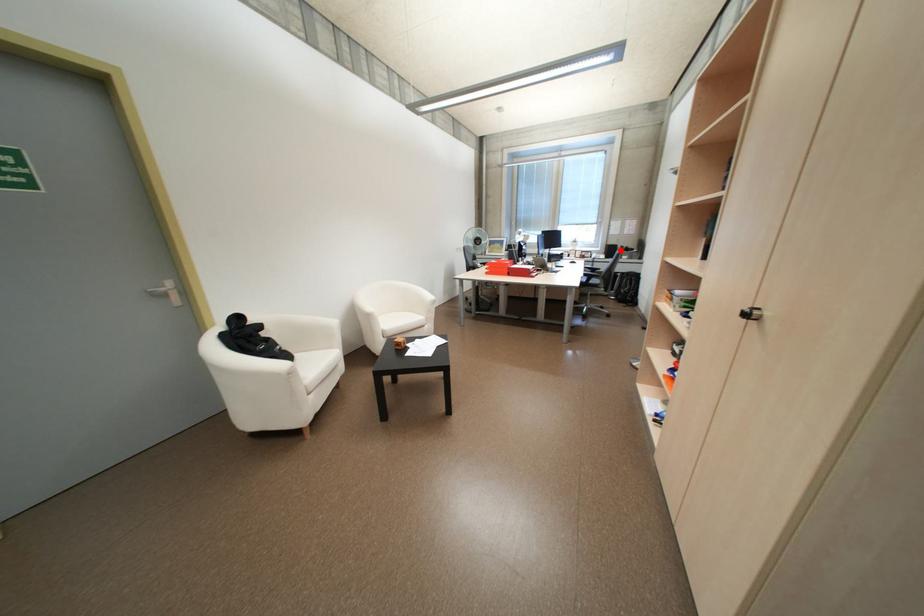
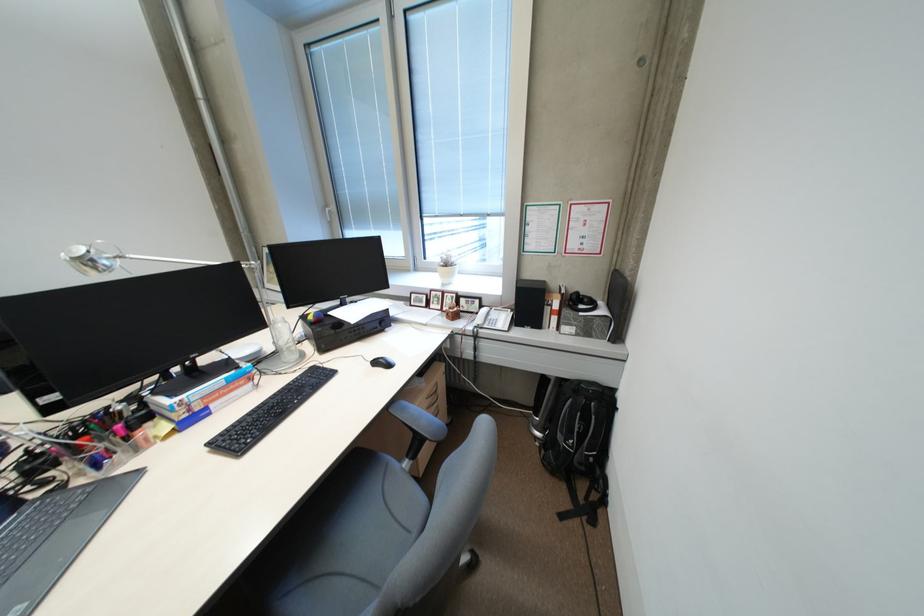
Question: I am providing you with two images of the same scene from different viewpoints. A red point is marked on the first image. Is the red point's position out of view in image 2?

Choices:
 (A) Yes
 (B) No

Answer: (B)